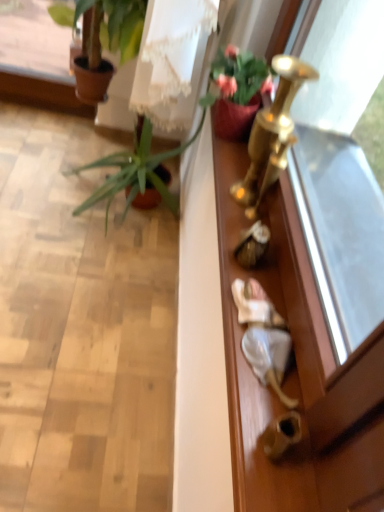
Identify the location of gold metallic door handle at lower right. Image resolution: width=384 pixels, height=512 pixels. (282, 434).

What is the approximate width of green leafy plant at left, placed as the first houseplant when sorted from back to front?

It is 22.80 inches.

The width and height of the screenshot is (384, 512). Describe the element at coordinates (311, 326) in the screenshot. I see `gold metallic screen door at right` at that location.

The image size is (384, 512). What are the coordinates of `gold metallic door handle at lower right` in the screenshot? It's located at (282, 434).

Based on the photo, from the image's perspective, between green matte plant at upper left, the second houseplant positioned from the front, and gold metallic screen door at right, which one is located above?

green matte plant at upper left, the second houseplant positioned from the front, is shown above in the image.

Who is more distant, green matte plant at upper left, the second houseplant positioned from the front, or gold metallic screen door at right?

Positioned behind is green matte plant at upper left, the second houseplant positioned from the front.

Is point (133, 3) in front of point (277, 295)?

No, (133, 3) is behind (277, 295).

Between green leafy plant at left, placed as the first houseplant when sorted from back to front, and gold metallic door handle at lower right, which one is positioned behind?

green leafy plant at left, placed as the first houseplant when sorted from back to front.

Would you say gold metallic door handle at lower right is part of green leafy plant at left, placed as the first houseplant when sorted from back to front,'s contents?

Actually, gold metallic door handle at lower right is outside green leafy plant at left, placed as the first houseplant when sorted from back to front.

Is green leafy plant at left, which is counted as the third houseplant, starting from the front, turned away from gold metallic door handle at lower right?

No, gold metallic door handle at lower right is not at the back of green leafy plant at left, which is counted as the third houseplant, starting from the front.

Which object is closer to the camera taking this photo, green matte plant at upper left, marked as the second houseplant in a back-to-front arrangement, or green leafy plant at left, which is counted as the third houseplant, starting from the front?

green matte plant at upper left, marked as the second houseplant in a back-to-front arrangement, is more forward.

From the image's perspective, does green matte plant at upper left, marked as the second houseplant in a back-to-front arrangement, appear lower than green leafy plant at left, which is counted as the third houseplant, starting from the front?

Actually, green matte plant at upper left, marked as the second houseplant in a back-to-front arrangement, appears above green leafy plant at left, which is counted as the third houseplant, starting from the front, in the image.

From a real-world perspective, is green matte plant at upper left, the second houseplant positioned from the front, above or below green leafy plant at left, placed as the first houseplant when sorted from back to front?

Clearly, from a real-world perspective, green matte plant at upper left, the second houseplant positioned from the front, is above green leafy plant at left, placed as the first houseplant when sorted from back to front.

How different are the orientations of green leafy plant at left, which is counted as the third houseplant, starting from the front, and gold metallic screen door at right in degrees?

They differ by 0.532 degrees in their facing directions.

Is green leafy plant at left, placed as the first houseplant when sorted from back to front, in front of or behind gold metallic screen door at right in the image?

Visually, green leafy plant at left, placed as the first houseplant when sorted from back to front, is located behind gold metallic screen door at right.

Would you consider green leafy plant at left, placed as the first houseplant when sorted from back to front, to be distant from gold metallic screen door at right?

green leafy plant at left, placed as the first houseplant when sorted from back to front, is actually quite close to gold metallic screen door at right.

From the image's perspective, is green leafy plant at left, which is counted as the third houseplant, starting from the front, under gold metallic screen door at right?

Incorrect, from the image's perspective, green leafy plant at left, which is counted as the third houseplant, starting from the front, is higher than gold metallic screen door at right.

Consider the image. Based on their positions, is green leafy plant at left, placed as the first houseplant when sorted from back to front, located to the left or right of matte pink pot at upper right, the 1th houseplant from the front?

In the image, green leafy plant at left, placed as the first houseplant when sorted from back to front, appears on the left side of matte pink pot at upper right, the 1th houseplant from the front.

In the scene shown: Which of these two, green leafy plant at left, placed as the first houseplant when sorted from back to front, or matte pink pot at upper right, positioned as the 3th houseplant in back-to-front order, is wider?

With larger width is green leafy plant at left, placed as the first houseplant when sorted from back to front.

Is green leafy plant at left, placed as the first houseplant when sorted from back to front, beside matte pink pot at upper right, the 1th houseplant from the front?

green leafy plant at left, placed as the first houseplant when sorted from back to front, is not next to matte pink pot at upper right, the 1th houseplant from the front, and they're not touching.

Considering the sizes of objects gold metallic door handle at lower right and green leafy plant at left, placed as the first houseplant when sorted from back to front, in the image provided, who is wider, gold metallic door handle at lower right or green leafy plant at left, placed as the first houseplant when sorted from back to front,?

With larger width is green leafy plant at left, placed as the first houseplant when sorted from back to front.

From a real-world perspective, is gold metallic door handle at lower right on top of green leafy plant at left, placed as the first houseplant when sorted from back to front?

Yes, from a real-world perspective, gold metallic door handle at lower right is over green leafy plant at left, placed as the first houseplant when sorted from back to front

Can you confirm if gold metallic door handle at lower right is shorter than green leafy plant at left, which is counted as the third houseplant, starting from the front?

Yes, gold metallic door handle at lower right is shorter than green leafy plant at left, which is counted as the third houseplant, starting from the front.

How many degrees apart are the facing directions of gold metallic door handle at lower right and green leafy plant at left, placed as the first houseplant when sorted from back to front?

The angular difference between gold metallic door handle at lower right and green leafy plant at left, placed as the first houseplant when sorted from back to front, is 0.398 degrees.

Locate an element on the screen. door handle located on the right of matte pink pot at upper right, the 1th houseplant from the front is located at coordinates (282, 434).

Is gold metallic door handle at lower right far from matte pink pot at upper right, the 1th houseplant from the front?

No, there isn't a large distance between gold metallic door handle at lower right and matte pink pot at upper right, the 1th houseplant from the front.

Does point (268, 444) come closer to viewer compared to point (240, 96)?

Yes.

Is gold metallic door handle at lower right smaller than matte pink pot at upper right, the 1th houseplant from the front?

Yes.

What are the coordinates of `screen door that is above the green matte plant at upper left, the second houseplant positioned from the front (from a real-world perspective)` in the screenshot? It's located at (311, 326).

Locate an element on the screen. The width and height of the screenshot is (384, 512). door handle in front of the green leafy plant at left, which is counted as the third houseplant, starting from the front is located at coordinates (282, 434).

Looking at this image, based on their spatial positions, is green leafy plant at left, which is counted as the third houseplant, starting from the front, or matte pink pot at upper right, positioned as the 3th houseplant in back-to-front order, closer to gold metallic screen door at right?

Among the two, matte pink pot at upper right, positioned as the 3th houseplant in back-to-front order, is located nearer to gold metallic screen door at right.

Considering their positions, is matte pink pot at upper right, the 1th houseplant from the front, positioned further to green leafy plant at left, placed as the first houseplant when sorted from back to front, than gold metallic screen door at right?

gold metallic screen door at right is further to green leafy plant at left, placed as the first houseplant when sorted from back to front.

When comparing their distances from matte pink pot at upper right, the 1th houseplant from the front, does gold metallic screen door at right or gold metallic door handle at lower right seem closer?

gold metallic screen door at right lies closer to matte pink pot at upper right, the 1th houseplant from the front, than the other object.

In the scene shown: From the image, which object appears to be nearer to gold metallic screen door at right, matte pink pot at upper right, positioned as the 3th houseplant in back-to-front order, or gold metallic door handle at lower right?

gold metallic door handle at lower right is positioned closer to the anchor gold metallic screen door at right.

Considering their positions, is gold metallic screen door at right positioned closer to gold metallic door handle at lower right than green matte plant at upper left, marked as the second houseplant in a back-to-front arrangement?

gold metallic screen door at right is positioned closer to the anchor gold metallic door handle at lower right.

Which object lies nearer to the anchor point matte pink pot at upper right, positioned as the 3th houseplant in back-to-front order, green matte plant at upper left, marked as the second houseplant in a back-to-front arrangement, or gold metallic door handle at lower right?

Among the two, gold metallic door handle at lower right is located nearer to matte pink pot at upper right, positioned as the 3th houseplant in back-to-front order.

Considering their positions, is gold metallic screen door at right positioned closer to green leafy plant at left, which is counted as the third houseplant, starting from the front, than green matte plant at upper left, the second houseplant positioned from the front?

green matte plant at upper left, the second houseplant positioned from the front, lies closer to green leafy plant at left, which is counted as the third houseplant, starting from the front, than the other object.

Looking at the image, which one is located closer to matte pink pot at upper right, positioned as the 3th houseplant in back-to-front order, green matte plant at upper left, marked as the second houseplant in a back-to-front arrangement, or green leafy plant at left, which is counted as the third houseplant, starting from the front?

Among the two, green leafy plant at left, which is counted as the third houseplant, starting from the front, is located nearer to matte pink pot at upper right, positioned as the 3th houseplant in back-to-front order.

The height and width of the screenshot is (512, 384). What are the coordinates of `houseplant between matte pink pot at upper right, positioned as the 3th houseplant in back-to-front order, and green leafy plant at left, placed as the first houseplant when sorted from back to front, along the z-axis` in the screenshot? It's located at (102, 37).

Where is `houseplant between gold metallic screen door at right and green matte plant at upper left, marked as the second houseplant in a back-to-front arrangement, along the z-axis`? The image size is (384, 512). houseplant between gold metallic screen door at right and green matte plant at upper left, marked as the second houseplant in a back-to-front arrangement, along the z-axis is located at coordinates (236, 91).

Find the location of a particular element. This screenshot has width=384, height=512. screen door between matte pink pot at upper right, the 1th houseplant from the front, and gold metallic door handle at lower right vertically is located at coordinates (311, 326).

Identify the location of screen door between green matte plant at upper left, the second houseplant positioned from the front, and gold metallic door handle at lower right in the up-down direction. The image size is (384, 512). (311, 326).